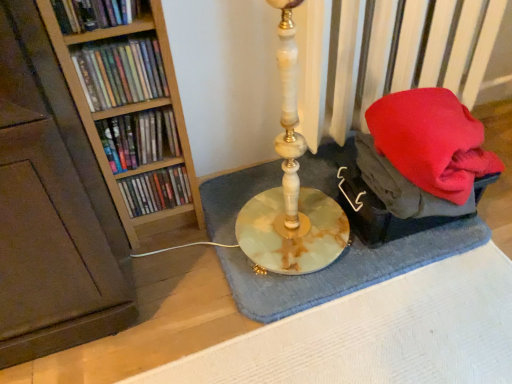
What do you see at coordinates (351, 265) in the screenshot? I see `blue textured bath mat at center` at bounding box center [351, 265].

The width and height of the screenshot is (512, 384). What do you see at coordinates (121, 73) in the screenshot?
I see `matte plastic books at left, which is counted as the third book, starting from the bottom` at bounding box center [121, 73].

Image resolution: width=512 pixels, height=384 pixels. I want to click on blue textured bath mat at center, so click(x=351, y=265).

The height and width of the screenshot is (384, 512). What are the coordinates of `bath mat behind the matte plastic books at left, which is the second book from bottom to top` in the screenshot? It's located at (351, 265).

Is matte plastic books at left, positioned as the 3th book in top-to-bottom order, to the left of blue textured bath mat at center from the viewer's perspective?

A: Indeed, matte plastic books at left, positioned as the 3th book in top-to-bottom order, is positioned on the left side of blue textured bath mat at center.

Between matte plastic books at left, which is the second book from bottom to top, and blue textured bath mat at center, which one has more height?

With more height is matte plastic books at left, which is the second book from bottom to top.

How different are the orientations of matte plastic books at left, which is the second book from bottom to top, and blue textured bath mat at center in degrees?

0.00141 degrees.

From a real-world perspective, who is located lower, matte plastic books at left, which is counted as the third book, starting from the bottom, or blue textured bath mat at center?

blue textured bath mat at center, from a real-world perspective.

Could you tell me if matte plastic books at left, which is the 2th book from top to bottom, is facing blue textured bath mat at center?

No, matte plastic books at left, which is the 2th book from top to bottom, does not turn towards blue textured bath mat at center.

Looking at their sizes, would you say matte plastic books at left, which is the 2th book from top to bottom, is wider or thinner than blue textured bath mat at center?

Considering their sizes, matte plastic books at left, which is the 2th book from top to bottom, looks slimmer than blue textured bath mat at center.

Would you say matte plastic book at upper left, marked as the first book in a top-to-bottom arrangement, is inside or outside matte plastic books at left, which is counted as the third book, starting from the bottom?

matte plastic book at upper left, marked as the first book in a top-to-bottom arrangement, exists outside the volume of matte plastic books at left, which is counted as the third book, starting from the bottom.

Is matte plastic book at upper left, the 4th book from the bottom, far from matte plastic books at left, which is counted as the third book, starting from the bottom?

They are positioned close to each other.

Considering the sizes of objects matte plastic book at upper left, marked as the first book in a top-to-bottom arrangement, and matte plastic books at left, which is the 2th book from top to bottom, in the image provided, who is wider, matte plastic book at upper left, marked as the first book in a top-to-bottom arrangement, or matte plastic books at left, which is the 2th book from top to bottom,?

matte plastic books at left, which is the 2th book from top to bottom.

Measure the distance between matte plastic book at upper left, the 4th book from the bottom, and matte plastic books at left, which is the 2th book from top to bottom.

matte plastic book at upper left, the 4th book from the bottom, and matte plastic books at left, which is the 2th book from top to bottom, are 3.54 inches apart.

Does matte plastic books at left, the fourth book viewed from the top, turn towards matte plastic books at left, which is the second book from bottom to top?

No, matte plastic books at left, the fourth book viewed from the top, does not turn towards matte plastic books at left, which is the second book from bottom to top.

What's the angular difference between matte plastic books at left, the fourth book viewed from the top, and matte plastic books at left, positioned as the 3th book in top-to-bottom order,'s facing directions?

They differ by 0.00504 degrees in their facing directions.

Measure the distance between matte plastic books at left, the fourth book viewed from the top, and matte plastic books at left, positioned as the 3th book in top-to-bottom order.

9.34 centimeters.

Looking at this image, can we say matte plastic books at left, positioned as the first book in bottom-to-top order, lies outside matte plastic books at left, which is the second book from bottom to top?

Indeed, matte plastic books at left, positioned as the first book in bottom-to-top order, is completely outside matte plastic books at left, which is the second book from bottom to top.

Looking at this image, which is more to the right, matte plastic books at left, positioned as the first book in bottom-to-top order, or matte plastic books at left, which is the 2th book from top to bottom?

From the viewer's perspective, matte plastic books at left, positioned as the first book in bottom-to-top order, appears more on the right side.

What's the angular difference between matte plastic books at left, positioned as the first book in bottom-to-top order, and matte plastic books at left, which is counted as the third book, starting from the bottom,'s facing directions?

There is a 0-degree angle between the facing directions of matte plastic books at left, positioned as the first book in bottom-to-top order, and matte plastic books at left, which is counted as the third book, starting from the bottom.

Considering the sizes of matte plastic books at left, positioned as the first book in bottom-to-top order, and matte plastic books at left, which is the 2th book from top to bottom, in the image, is matte plastic books at left, positioned as the first book in bottom-to-top order, wider or thinner than matte plastic books at left, which is the 2th book from top to bottom,?

Clearly, matte plastic books at left, positioned as the first book in bottom-to-top order, has less width compared to matte plastic books at left, which is the 2th book from top to bottom.

Which is nearer, (467, 224) or (63, 9)?

The point (63, 9) is more forward.

Looking at this image, considering the sizes of blue textured bath mat at center and matte plastic book at upper left, marked as the first book in a top-to-bottom arrangement, in the image, is blue textured bath mat at center wider or thinner than matte plastic book at upper left, marked as the first book in a top-to-bottom arrangement,?

blue textured bath mat at center is wider than matte plastic book at upper left, marked as the first book in a top-to-bottom arrangement.

From the image's perspective, does blue textured bath mat at center appear higher than matte plastic book at upper left, marked as the first book in a top-to-bottom arrangement?

No, from the image's perspective, blue textured bath mat at center is not over matte plastic book at upper left, marked as the first book in a top-to-bottom arrangement.

From the picture: Is blue textured bath mat at center aimed at matte plastic book at upper left, marked as the first book in a top-to-bottom arrangement?

No, blue textured bath mat at center is not aimed at matte plastic book at upper left, marked as the first book in a top-to-bottom arrangement.

Is matte plastic books at left, the fourth book viewed from the top, wider than blue textured bath mat at center?

Incorrect, the width of matte plastic books at left, the fourth book viewed from the top, does not surpass that of blue textured bath mat at center.

From a real-world perspective, between matte plastic books at left, the fourth book viewed from the top, and blue textured bath mat at center, who is vertically higher?

From a 3D spatial view, matte plastic books at left, the fourth book viewed from the top, is above.

Is point (161, 175) farther from viewer compared to point (408, 234)?

No, it is in front of (408, 234).

Find the location of `bath mat on the right of the matte plastic books at left, which is the second book from bottom to top`. bath mat on the right of the matte plastic books at left, which is the second book from bottom to top is located at coordinates (351, 265).

Starting from the blue textured bath mat at center, which book is the 2nd one in front? Please provide its 2D coordinates.

[(121, 73)]

When comparing their distances from matte plastic books at left, which is the second book from bottom to top, does matte plastic book at upper left, the 4th book from the bottom, or matte plastic books at left, which is the 2th book from top to bottom, seem further?

Based on the image, matte plastic book at upper left, the 4th book from the bottom, appears to be further to matte plastic books at left, which is the second book from bottom to top.

Considering their positions, is matte plastic books at left, positioned as the first book in bottom-to-top order, positioned further to matte plastic books at left, which is the second book from bottom to top, than blue textured bath mat at center?

blue textured bath mat at center lies further to matte plastic books at left, which is the second book from bottom to top, than the other object.

Which object lies nearer to the anchor point matte plastic book at upper left, marked as the first book in a top-to-bottom arrangement, matte plastic books at left, which is the 2th book from top to bottom, or blue textured bath mat at center?

The object closer to matte plastic book at upper left, marked as the first book in a top-to-bottom arrangement, is matte plastic books at left, which is the 2th book from top to bottom.

Based on their spatial positions, is matte plastic books at left, positioned as the first book in bottom-to-top order, or matte plastic books at left, which is the second book from bottom to top, closer to matte plastic book at upper left, marked as the first book in a top-to-bottom arrangement?

Based on the image, matte plastic books at left, which is the second book from bottom to top, appears to be nearer to matte plastic book at upper left, marked as the first book in a top-to-bottom arrangement.

From the image, which object appears to be farther from blue textured bath mat at center, matte plastic books at left, the fourth book viewed from the top, or matte plastic book at upper left, marked as the first book in a top-to-bottom arrangement?

matte plastic book at upper left, marked as the first book in a top-to-bottom arrangement, is further to blue textured bath mat at center.

Which object lies further to the anchor point matte plastic books at left, which is the second book from bottom to top, blue textured bath mat at center or matte plastic books at left, which is the 2th book from top to bottom?

blue textured bath mat at center is positioned further to the anchor matte plastic books at left, which is the second book from bottom to top.

When comparing their distances from blue textured bath mat at center, does matte plastic books at left, which is counted as the third book, starting from the bottom, or matte plastic book at upper left, the 4th book from the bottom, seem closer?

matte plastic books at left, which is counted as the third book, starting from the bottom, is closer to blue textured bath mat at center.

Estimate the real-world distances between objects in this image. Which object is closer to matte plastic book at upper left, the 4th book from the bottom, matte plastic books at left, which is counted as the third book, starting from the bottom, or matte plastic books at left, positioned as the first book in bottom-to-top order?

Based on the image, matte plastic books at left, which is counted as the third book, starting from the bottom, appears to be nearer to matte plastic book at upper left, the 4th book from the bottom.

At what (x,y) coordinates should I click in order to perform the action: click on book between matte plastic book at upper left, marked as the first book in a top-to-bottom arrangement, and matte plastic books at left, positioned as the 3th book in top-to-bottom order, in the vertical direction. Please return your answer as a coordinate pair (x, y). The image size is (512, 384). Looking at the image, I should click on pyautogui.click(x=121, y=73).

Where is `book between matte plastic books at left, which is counted as the third book, starting from the bottom, and matte plastic books at left, positioned as the first book in bottom-to-top order, in the vertical direction`? book between matte plastic books at left, which is counted as the third book, starting from the bottom, and matte plastic books at left, positioned as the first book in bottom-to-top order, in the vertical direction is located at coordinates (139, 138).

Locate an element on the screen. The image size is (512, 384). book between matte plastic books at left, which is the second book from bottom to top, and blue textured bath mat at center is located at coordinates (156, 190).